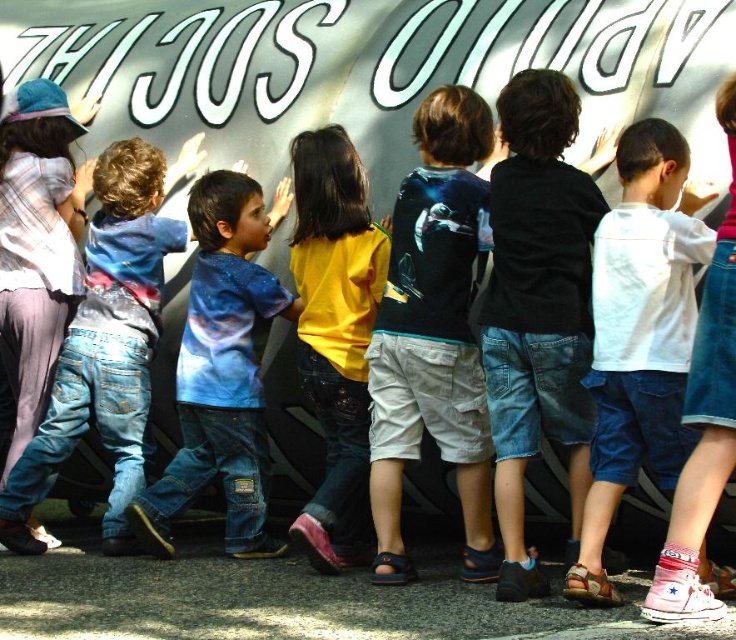
You are a photographer trying to capture a photo of the denim jeans at left and the blue galaxy print shirt at center in the same frame. Based on the scene description, can you fit both subjects into your camera frame that has a maximum width of 10 feet?

The denim jeans at left and blue galaxy print shirt at center are 9.75 feet apart, so yes, both subjects can be captured in the camera frame since the distance between them is less than the maximum width of 10 feet.

Based on the scene described, which clothing item is positioned more to the left between the denim jeans at left and the blue galaxy print shirt at center?

The denim jeans at left are positioned more to the left than the blue galaxy print shirt at center according to the description.